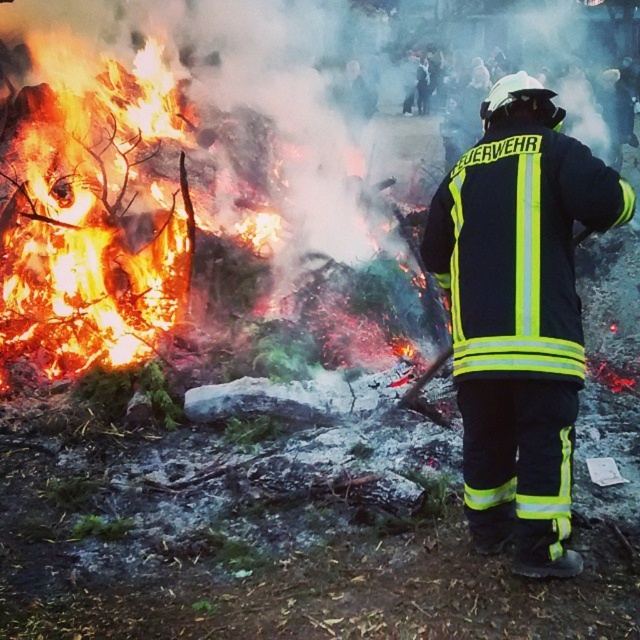
You are a firefighter trying to locate the source of the fire. Where exactly is the flaming wood at left located in the image?

The flaming wood at left is located at point [166,173] in the image.